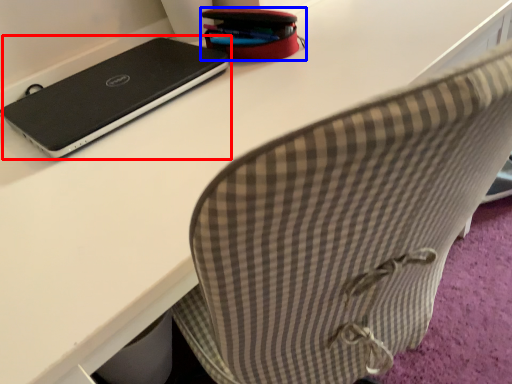
Question: Which object is further to the camera taking this photo, laptop (highlighted by a red box) or pencil case (highlighted by a blue box)?

Choices:
 (A) laptop
 (B) pencil case

Answer: (B)